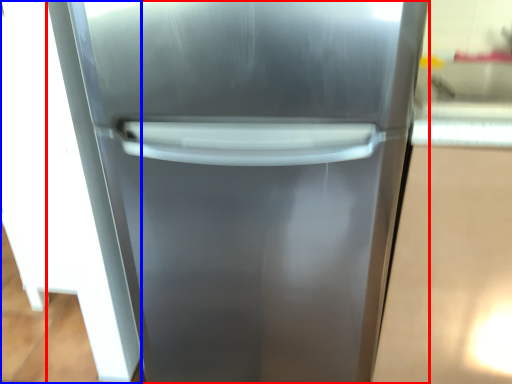
Question: Which object is closer to the camera taking this photo, refrigerator (highlighted by a red box) or glass door (highlighted by a blue box)?

Choices:
 (A) refrigerator
 (B) glass door

Answer: (A)